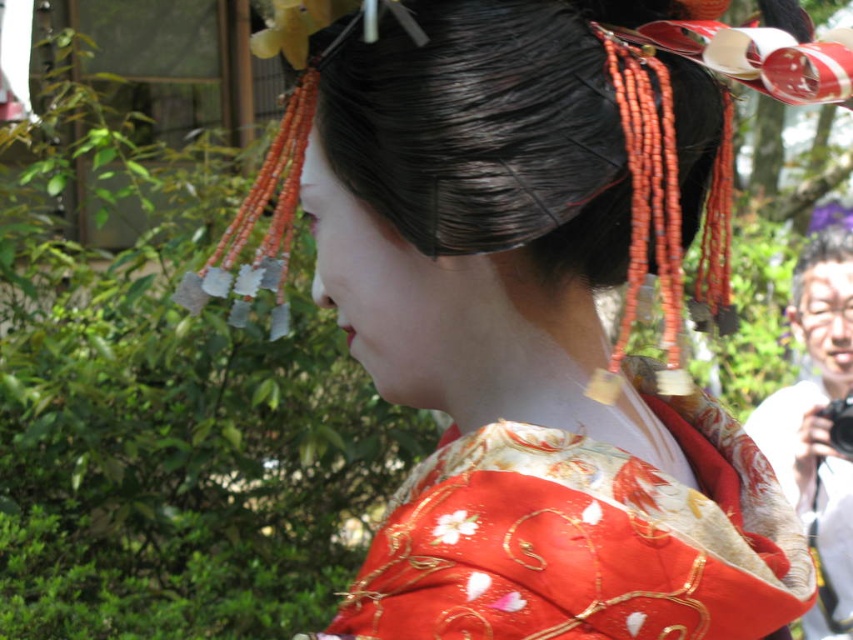
Question: Which point is farther from the camera taking this photo?

Choices:
 (A) (555, 538)
 (B) (666, 627)

Answer: (B)

Question: Estimate the real-world distances between objects in this image. Which object is farther from the silky kimono at center?

Choices:
 (A) black glossy hair at upper right
 (B) silky red kimono at center

Answer: (A)

Question: Is silky red kimono at center smaller than black glossy hair at upper right?

Choices:
 (A) yes
 (B) no

Answer: (B)

Question: Which point is closer to the camera?

Choices:
 (A) (695, 582)
 (B) (833, 236)

Answer: (A)

Question: Is silky kimono at center bigger than silky red kimono at center?

Choices:
 (A) no
 (B) yes

Answer: (B)

Question: Is silky kimono at center below black glossy hair at upper right?

Choices:
 (A) no
 (B) yes

Answer: (B)